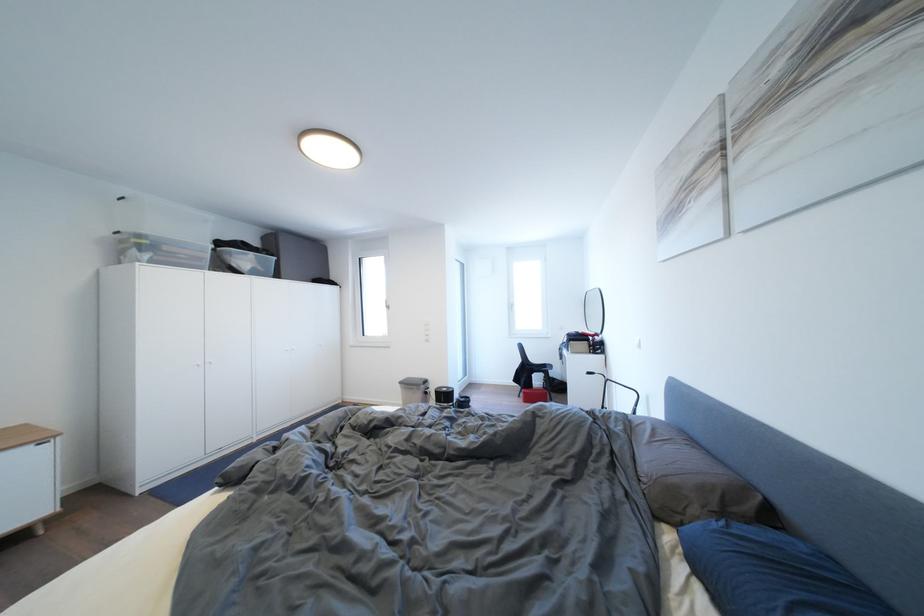
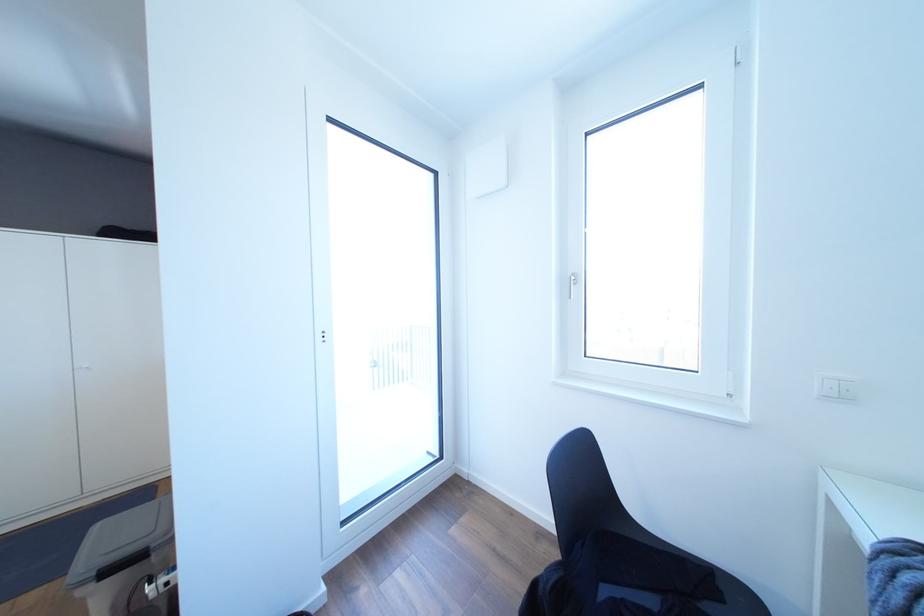
Question: What movement of the cameraman would produce the second image?

Choices:
 (A) Left
 (B) Right
 (C) Forward
 (D) Backward

Answer: (C)